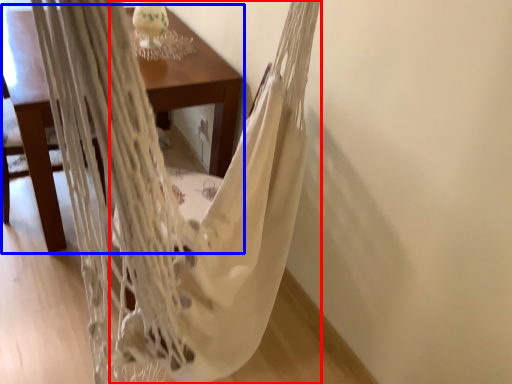
Question: Among these objects, which one is farthest to the camera, blanket (highlighted by a red box) or table (highlighted by a blue box)?

Choices:
 (A) blanket
 (B) table

Answer: (B)